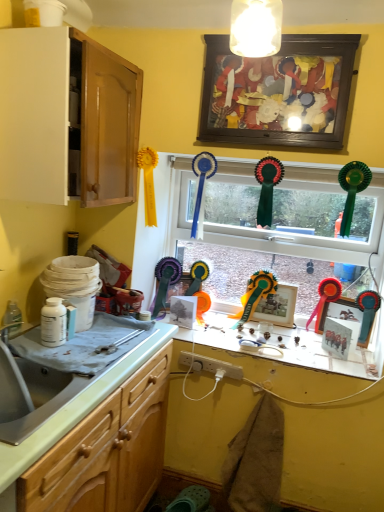
Question: Is metallic silver picture frame at right, the fifth picture frame in the top-to-bottom sequence, in front of or behind wooden picture frame at upper center, which ranks as the first picture frame in top-to-bottom order, in the image?

Choices:
 (A) behind
 (B) front

Answer: (A)

Question: From a real-world perspective, is metallic silver picture frame at right, which is the first picture frame from bottom to top, above or below wooden picture frame at upper center, which ranks as the first picture frame in top-to-bottom order?

Choices:
 (A) below
 (B) above

Answer: (A)

Question: Which of these objects is positioned farthest from the matte white light fixture at upper center?

Choices:
 (A) white plastic plug at center
 (B) glass window at center
 (C) wooden picture frame at upper center, marked as the 5th picture frame in a bottom-to-top arrangement
 (D) white glossy cabinet at upper left, marked as the 2th cabinetry in a bottom-to-top arrangement
 (E) metallic gold picture frame at center, the 2th picture frame from the top

Answer: (E)

Question: Which of these objects is positioned closest to the metallic gold picture frame at center, the fourth picture frame positioned from the bottom?

Choices:
 (A) wooden picture frame at upper center, marked as the 5th picture frame in a bottom-to-top arrangement
 (B) glass window at center
 (C) silver metallic sink at lower left
 (D) metallic silver picture frame at right, which is the second picture frame in bottom-to-top order
 (E) white glossy cabinet at upper left, which is the first cabinetry in top-to-bottom order

Answer: (D)